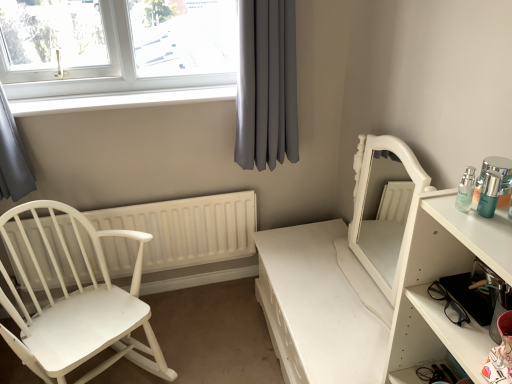
You are a GUI agent. You are given a task and a screenshot of the screen. Output one action in this format:
    pyautogui.click(x=<x>, y=<y>)
    Task: Click on the vacant space in front of matte glass bottles at right
    The image size is (512, 384).
    Given the screenshot: What is the action you would take?
    pyautogui.click(x=485, y=227)